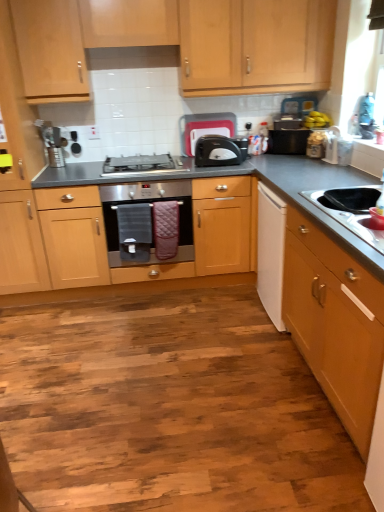
Question: Can you confirm if satin silver gas stove at center is smaller than stainless steel oven at center?

Choices:
 (A) yes
 (B) no

Answer: (A)

Question: Considering the relative sizes of satin silver gas stove at center and stainless steel oven at center in the image provided, is satin silver gas stove at center taller than stainless steel oven at center?

Choices:
 (A) no
 (B) yes

Answer: (A)

Question: Can you confirm if satin silver gas stove at center is wider than stainless steel oven at center?

Choices:
 (A) yes
 (B) no

Answer: (B)

Question: Is satin silver gas stove at center positioned beyond the bounds of stainless steel oven at center?

Choices:
 (A) yes
 (B) no

Answer: (A)

Question: Is satin silver gas stove at center oriented away from stainless steel oven at center?

Choices:
 (A) no
 (B) yes

Answer: (A)

Question: Based on their sizes in the image, would you say white matte drawer at right is bigger or smaller than light wood cabinet at right, which ranks as the second cabinetry in back-to-front order?

Choices:
 (A) big
 (B) small

Answer: (B)

Question: Considering the positions of white matte drawer at right and light wood cabinet at right, which is the 2th cabinetry from top to bottom, in the image, is white matte drawer at right taller or shorter than light wood cabinet at right, which is the 2th cabinetry from top to bottom,?

Choices:
 (A) tall
 (B) short

Answer: (A)

Question: From the image's perspective, is white matte drawer at right located above or below light wood cabinet at right, which ranks as the second cabinetry in back-to-front order?

Choices:
 (A) below
 (B) above

Answer: (B)

Question: Is white matte drawer at right situated inside light wood cabinet at right, positioned as the 1th cabinetry in bottom-to-top order, or outside?

Choices:
 (A) inside
 (B) outside

Answer: (B)

Question: Considering the positions of black plastic toaster at upper center, acting as the third appliance starting from the right, and stainless steel sink at lower right in the image, is black plastic toaster at upper center, acting as the third appliance starting from the right, bigger or smaller than stainless steel sink at lower right?

Choices:
 (A) big
 (B) small

Answer: (B)

Question: Relative to stainless steel sink at lower right, is black plastic toaster at upper center, acting as the third appliance starting from the right, in front or behind?

Choices:
 (A) behind
 (B) front

Answer: (A)

Question: Is point 180,140 closer or farther from the camera than point 382,234?

Choices:
 (A) farther
 (B) closer

Answer: (A)

Question: From the image's perspective, is black plastic toaster at upper center, placed as the second appliance when sorted from left to right, located above or below stainless steel sink at lower right?

Choices:
 (A) above
 (B) below

Answer: (A)

Question: Considering the positions of brushed metal toaster at center, which appears as the fourth appliance when viewed from the right, and stainless steel sink at lower right in the image, is brushed metal toaster at center, which appears as the fourth appliance when viewed from the right, bigger or smaller than stainless steel sink at lower right?

Choices:
 (A) big
 (B) small

Answer: (B)

Question: Considering the positions of brushed metal toaster at center, which appears as the fourth appliance when viewed from the right, and stainless steel sink at lower right in the image, is brushed metal toaster at center, which appears as the fourth appliance when viewed from the right, taller or shorter than stainless steel sink at lower right?

Choices:
 (A) tall
 (B) short

Answer: (A)